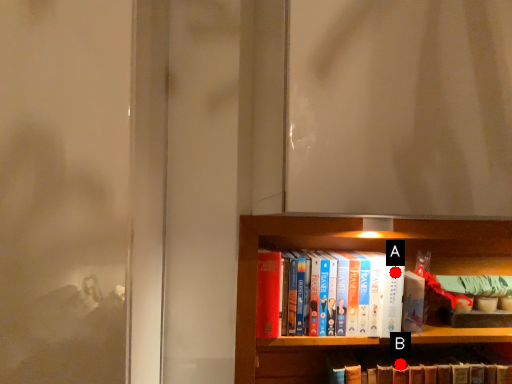
Question: Two points are circled on the image, labeled by A and B beside each circle. Which point appears farthest from the camera in this image?

Choices:
 (A) A is further
 (B) B is further

Answer: (B)